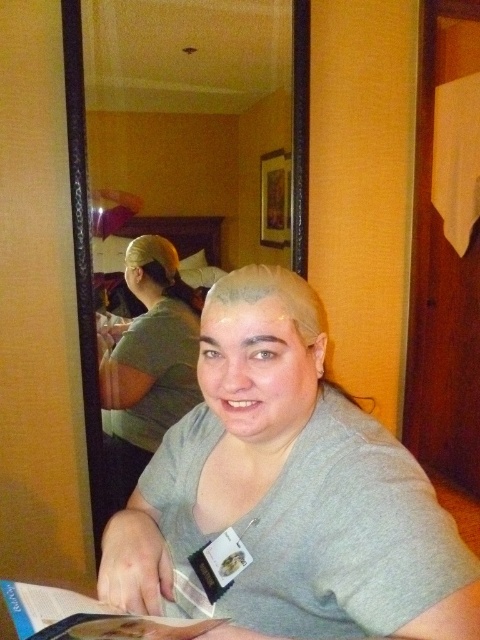
Question: From the image, what is the correct spatial relationship of green matte shirt at center in relation to matte paper magazine at lower left?

Choices:
 (A) right
 (B) left

Answer: (B)

Question: Which point appears farthest from the camera in this image?

Choices:
 (A) (132, 362)
 (B) (207, 454)

Answer: (A)

Question: Can you confirm if green matte shirt at center is positioned to the right of matte paper magazine at lower left?

Choices:
 (A) yes
 (B) no

Answer: (B)

Question: Among these objects, which one is nearest to the camera?

Choices:
 (A) matte paper magazine at lower left
 (B) gray matte shirt at center
 (C) green matte shirt at center

Answer: (A)

Question: Which object appears closest to the camera in this image?

Choices:
 (A) green matte shirt at center
 (B) gray matte shirt at center
 (C) matte paper magazine at lower left

Answer: (C)

Question: Is gray matte shirt at center thinner than matte paper magazine at lower left?

Choices:
 (A) no
 (B) yes

Answer: (A)